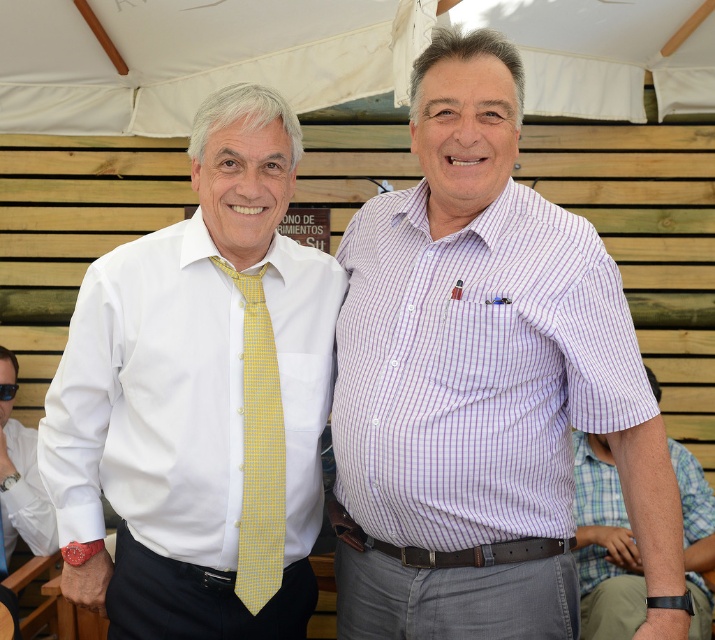
Is purple checkered shirt at center bigger than white shirt at center?

Indeed, purple checkered shirt at center has a larger size compared to white shirt at center.

Does purple checkered shirt at center have a greater width compared to white shirt at center?

Indeed, purple checkered shirt at center has a greater width compared to white shirt at center.

Where is `purple checkered shirt at center`? The height and width of the screenshot is (640, 715). purple checkered shirt at center is located at coordinates tap(603, 545).

The image size is (715, 640). What are the coordinates of `purple checkered shirt at center` in the screenshot? It's located at (603, 545).

Looking at this image, is white fabric canopy at upper center bigger than purple checkered shirt at center?

Actually, white fabric canopy at upper center might be smaller than purple checkered shirt at center.

Which of these two, white fabric canopy at upper center or purple checkered shirt at center, stands taller?

purple checkered shirt at center is taller.

Who is more distant from viewer, (300, 16) or (681, 515)?

The point (300, 16) is behind.

The width and height of the screenshot is (715, 640). Identify the location of white fabric canopy at upper center. (332, 56).

The height and width of the screenshot is (640, 715). Describe the element at coordinates (199, 401) in the screenshot. I see `white smooth shirt at center` at that location.

Find the location of a particular element. white smooth shirt at center is located at coordinates (199, 401).

Where is `white smooth shirt at center`? Image resolution: width=715 pixels, height=640 pixels. white smooth shirt at center is located at coordinates (199, 401).